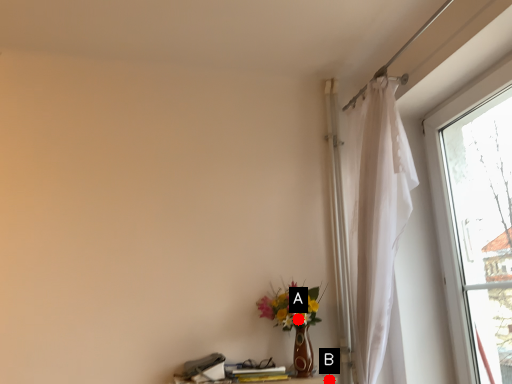
Question: Two points are circled on the image, labeled by A and B beside each circle. Which of the following is the farthest from the observer?

Choices:
 (A) A is further
 (B) B is further

Answer: (B)